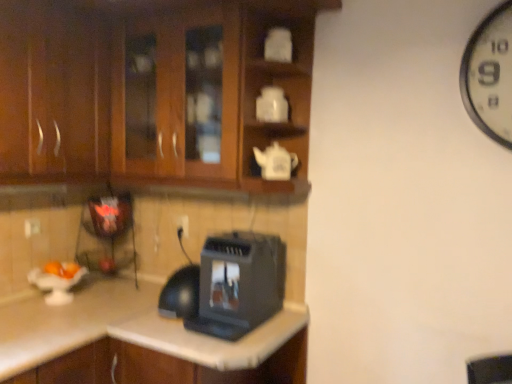
Question: From the image's perspective, is brown wood cabinets at upper left, positioned as the 2th cabinetry in left-to-right order, located above or below dark wood cabinet at left, which appears as the second cabinetry when viewed from the right?

Choices:
 (A) above
 (B) below

Answer: (A)

Question: Considering the positions of point (106, 178) and point (3, 127), is point (106, 178) closer or farther from the camera than point (3, 127)?

Choices:
 (A) farther
 (B) closer

Answer: (A)

Question: Estimate the real-world distances between objects in this image. Which object is closer to the metallic black toaster at lower left?

Choices:
 (A) black plastic toaster at lower center
 (B) brown wood cabinets at upper left, positioned as the 2th cabinetry in left-to-right order
 (C) dark wood cabinet at left, the 1th cabinetry positioned from the left
 (D) beige laminate countertop at lower center
 (E) white plastic electric outlet at center

Answer: (E)

Question: Considering the real-world distances, which object is farthest from the metallic black toaster at lower left?

Choices:
 (A) white plastic electric outlet at center
 (B) black plastic toaster at lower center
 (C) beige laminate countertop at lower center
 (D) dark wood cabinet at left, the 1th cabinetry positioned from the left
 (E) brown wood cabinets at upper left, positioned as the 2th cabinetry in left-to-right order

Answer: (B)